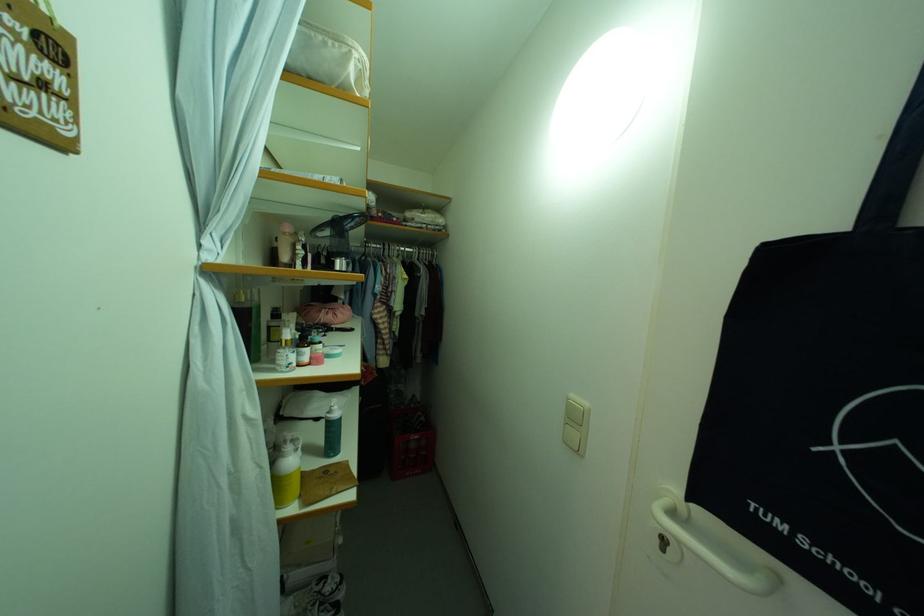
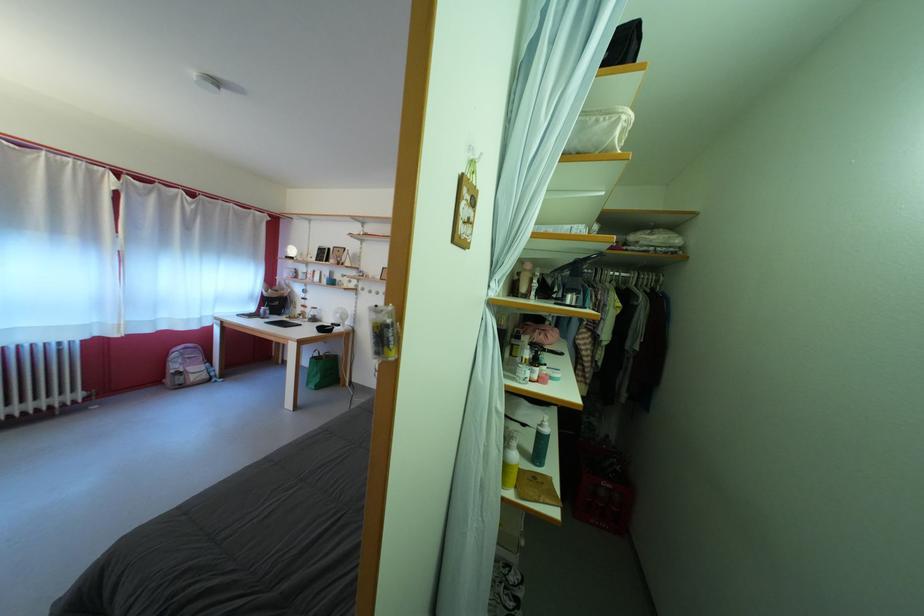
Question: The camera is either moving clockwise (left) or counter-clockwise (right) around the object. The first image is from the beginning of the video and the second image is from the end. Is the camera moving left or right when shooting the video?

Choices:
 (A) Left
 (B) Right

Answer: (B)